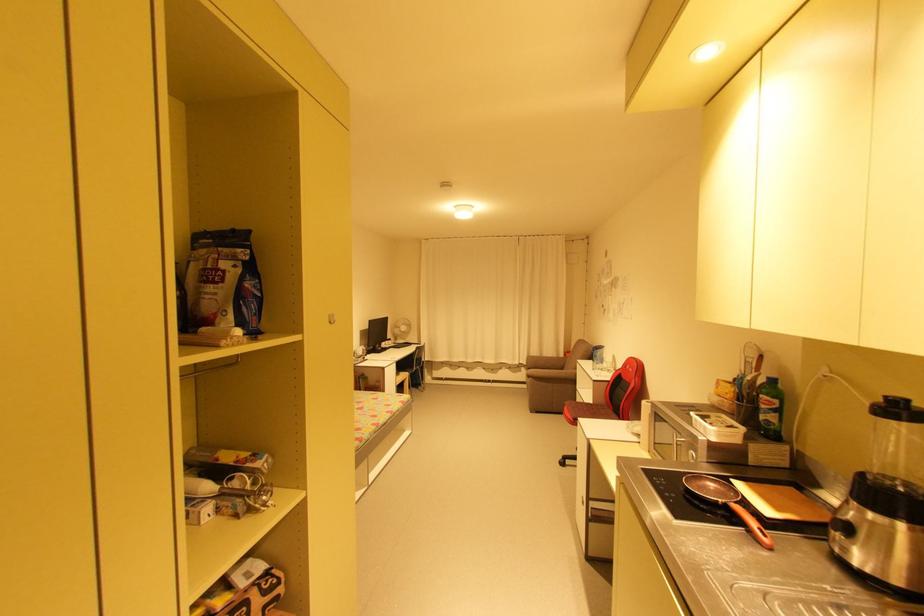
What do you see at coordinates (760, 533) in the screenshot? The height and width of the screenshot is (616, 924). I see `a frying pan handle` at bounding box center [760, 533].